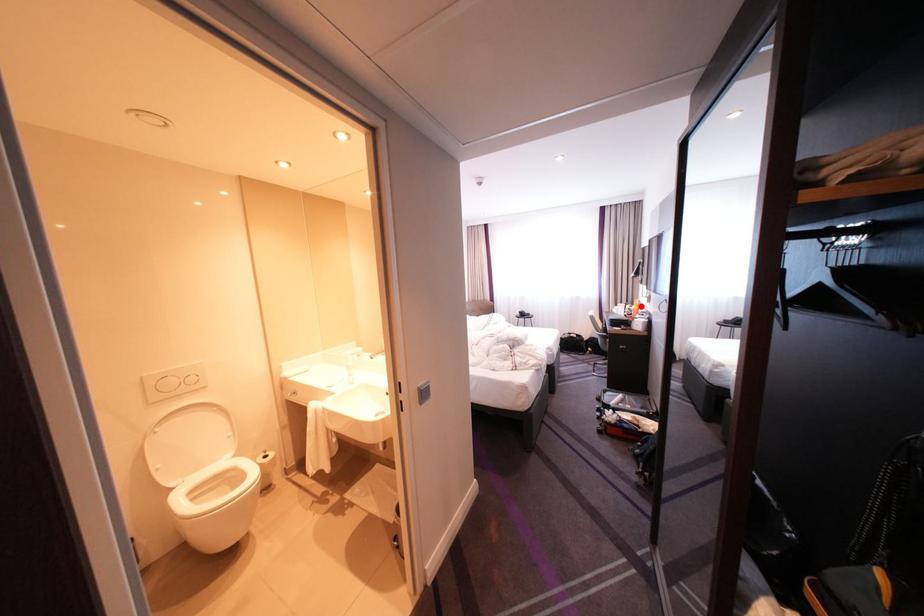
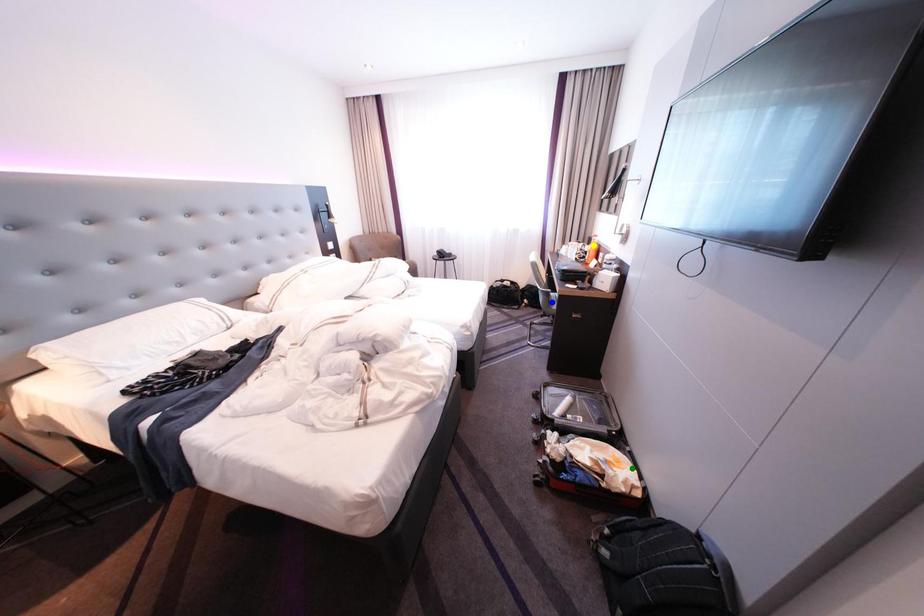
Question: I am providing you with two images of the same scene from different viewpoints. A red point is marked on the first image. You are given multiple points on the second image. Which mark in image 2 goes with the point in image 1?

Choices:
 (A) yellow point
 (B) green point
 (C) blue point

Answer: (A)